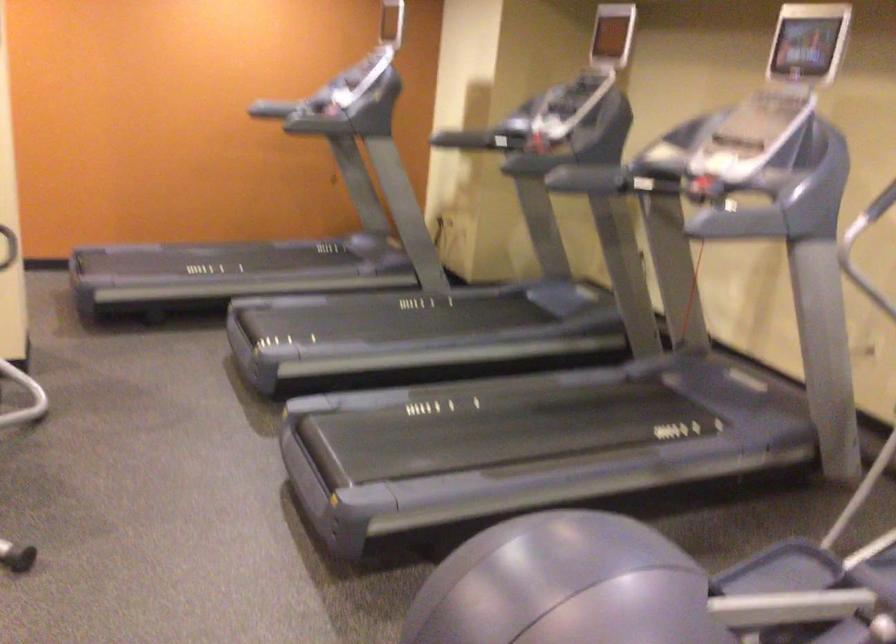
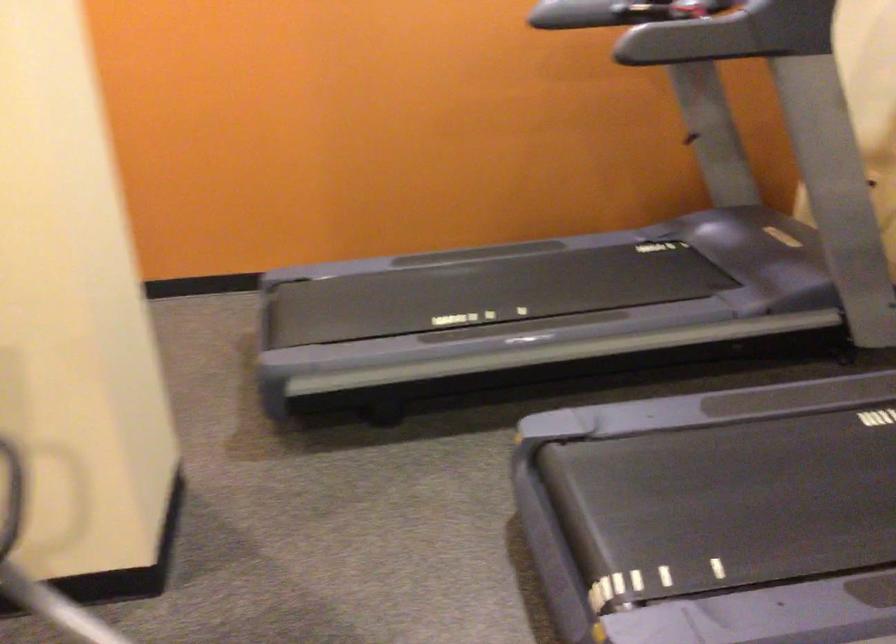
Where in the second image is the point corresponding to point (289, 108) from the first image?

(572, 15)